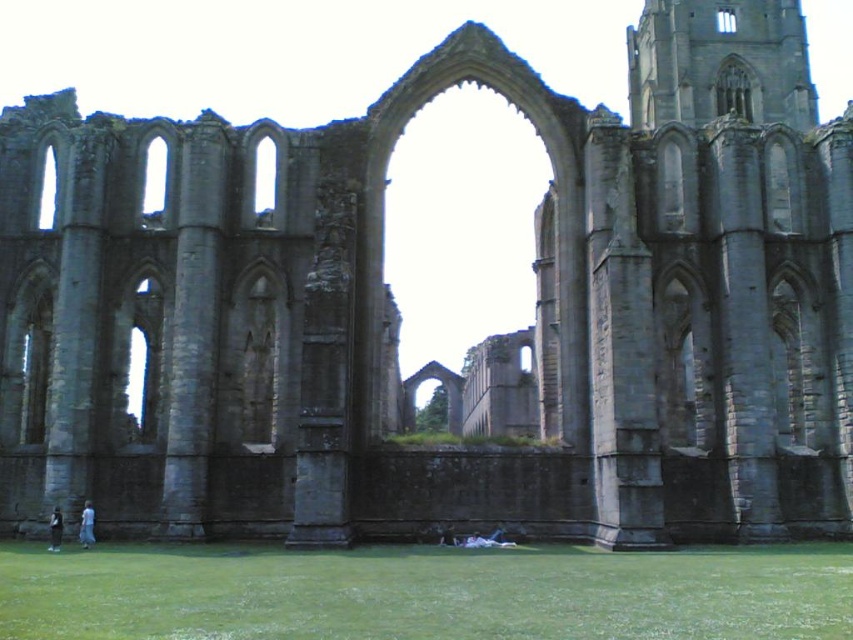
Which is in front, point (450, 600) or point (49, 547)?

Positioned in front is point (450, 600).

Which of these two, green grass at lower center or dark gray fabric jacket at lower left, stands taller?

green grass at lower center is taller.

What do you see at coordinates (425, 593) in the screenshot? This screenshot has height=640, width=853. I see `green grass at lower center` at bounding box center [425, 593].

Where is `green grass at lower center`? The width and height of the screenshot is (853, 640). green grass at lower center is located at coordinates (425, 593).

Who is lower down, blue fabric dress at lower left or dark gray fabric jacket at lower left?

blue fabric dress at lower left

Is blue fabric dress at lower left wider than dark gray fabric jacket at lower left?

Indeed, blue fabric dress at lower left has a greater width compared to dark gray fabric jacket at lower left.

Which is behind, point (88, 518) or point (59, 513)?

Point (88, 518)

This screenshot has width=853, height=640. Identify the location of blue fabric dress at lower left. (86, 525).

Who is positioned more to the left, green grass at lower center or blue fabric dress at lower left?

blue fabric dress at lower left

Between point (328, 573) and point (93, 541), which one is positioned behind?

Positioned behind is point (93, 541).

This screenshot has height=640, width=853. I want to click on green grass at lower center, so click(x=425, y=593).